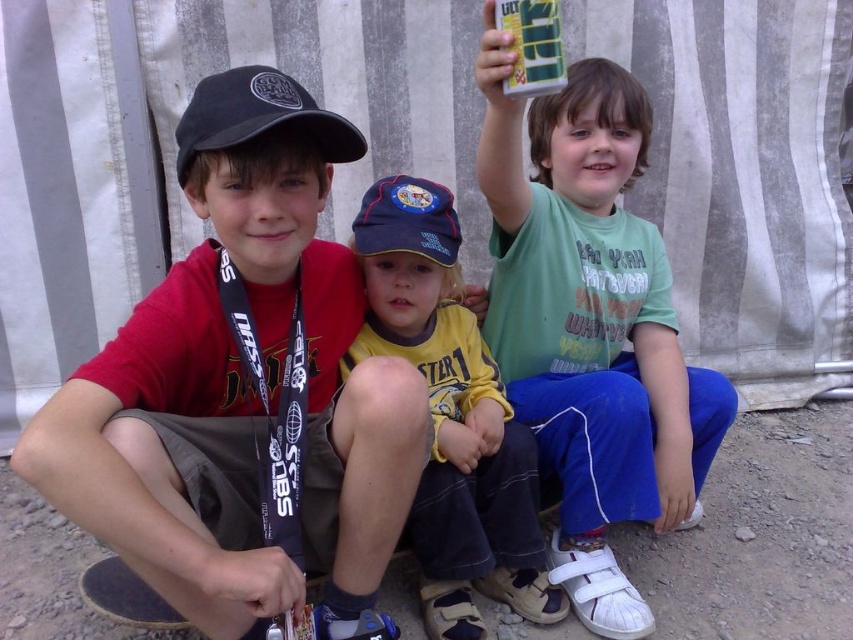
You are a photographer trying to capture the child on the left. The matte black cap at left and the black fabric baseball cap at left are both visible in the frame. Which one is positioned lower on the child?

The matte black cap at left is below the black fabric baseball cap at left, so the matte black cap at left is positioned lower on the child.

You are a photographer setting up for a group photo. You need to ensure that the green cotton shirt at center and the black fabric baseball cap at left are both in focus. Given that your camera can only focus on objects within a 25 inch range, will both subjects be in focus?

The distance between the green cotton shirt at center and the black fabric baseball cap at left is 25.21 inches. Since the camera can only focus within a 25 inch range, the subjects are slightly out of the focus range, so they may not both be in focus.